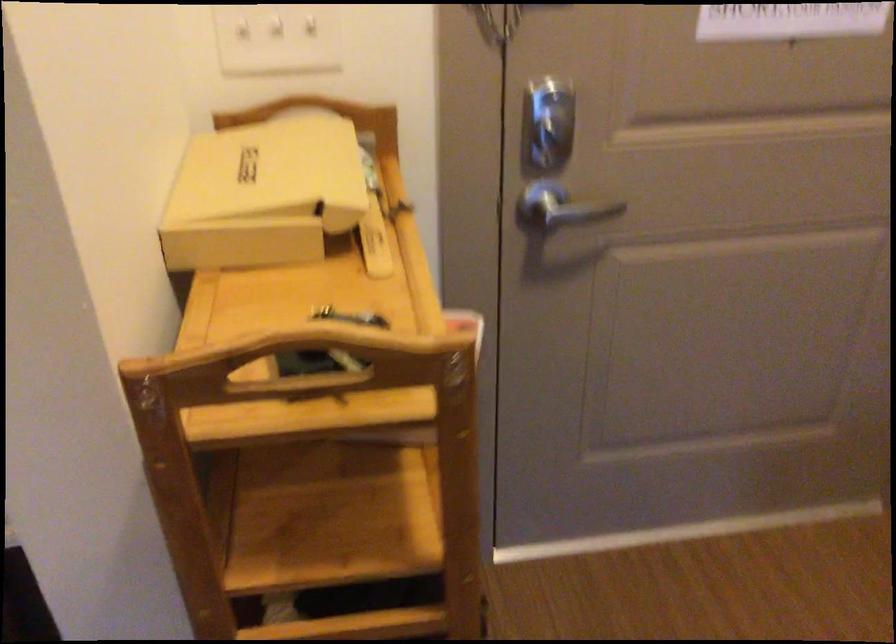
Describe the element at coordinates (547, 122) in the screenshot. I see `a door deadbolt lock` at that location.